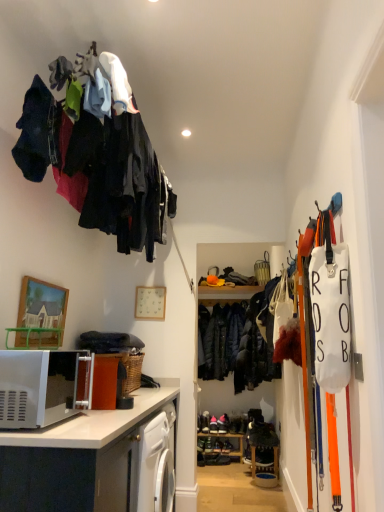
Question: From a real-world perspective, does wooden picture frame at upper left sit lower than black leather shoes at center, positioned as the 2th footwear in left-to-right order?

Choices:
 (A) no
 (B) yes

Answer: (A)

Question: Can you confirm if wooden picture frame at upper left is shorter than black leather shoes at center, which is the first footwear from right to left?

Choices:
 (A) yes
 (B) no

Answer: (B)

Question: Can you see wooden picture frame at upper left touching black leather shoes at center, positioned as the 2th footwear in left-to-right order?

Choices:
 (A) no
 (B) yes

Answer: (A)

Question: From the image's perspective, does wooden picture frame at upper left appear higher than black leather shoes at center, positioned as the 2th footwear in left-to-right order?

Choices:
 (A) yes
 (B) no

Answer: (A)

Question: Can you confirm if wooden picture frame at upper left is positioned to the left of black leather shoes at center, which is the first footwear from right to left?

Choices:
 (A) yes
 (B) no

Answer: (A)

Question: Is point (213, 423) closer or farther from the camera than point (38, 332)?

Choices:
 (A) farther
 (B) closer

Answer: (A)

Question: Considering the positions of dark brown leather shoes at center, which is the 1th footwear in left-to-right order, and wooden picture frame at upper left in the image, is dark brown leather shoes at center, which is the 1th footwear in left-to-right order, bigger or smaller than wooden picture frame at upper left?

Choices:
 (A) big
 (B) small

Answer: (B)

Question: Which is correct: dark brown leather shoes at center, which is the 1th footwear in left-to-right order, is inside wooden picture frame at upper left, or outside of it?

Choices:
 (A) inside
 (B) outside

Answer: (B)

Question: Is dark brown leather shoes at center, which ranks as the 2th footwear in right-to-left order, wider or thinner than wooden picture frame at upper left?

Choices:
 (A) wide
 (B) thin

Answer: (A)

Question: Based on their sizes in the image, would you say dark blue quilted jacket at center, which appears as the second clothing when viewed from the left, is bigger or smaller than white matte microwave at lower left?

Choices:
 (A) big
 (B) small

Answer: (A)

Question: Relative to white matte microwave at lower left, is dark blue quilted jacket at center, marked as the 1th clothing in a bottom-to-top arrangement, in front or behind?

Choices:
 (A) front
 (B) behind

Answer: (B)

Question: Considering the relative positions of dark blue quilted jacket at center, placed as the second clothing when sorted from front to back, and white matte microwave at lower left in the image provided, is dark blue quilted jacket at center, placed as the second clothing when sorted from front to back, to the left or to the right of white matte microwave at lower left?

Choices:
 (A) left
 (B) right

Answer: (B)

Question: Is point (203, 324) positioned closer to the camera than point (64, 400)?

Choices:
 (A) farther
 (B) closer

Answer: (A)

Question: Is wooden shelf at lower center spatially inside black leather shoes at center, which is the first footwear from right to left, or outside of it?

Choices:
 (A) outside
 (B) inside

Answer: (A)

Question: From a real-world perspective, is wooden shelf at lower center positioned above or below black leather shoes at center, which is the first footwear from right to left?

Choices:
 (A) above
 (B) below

Answer: (B)